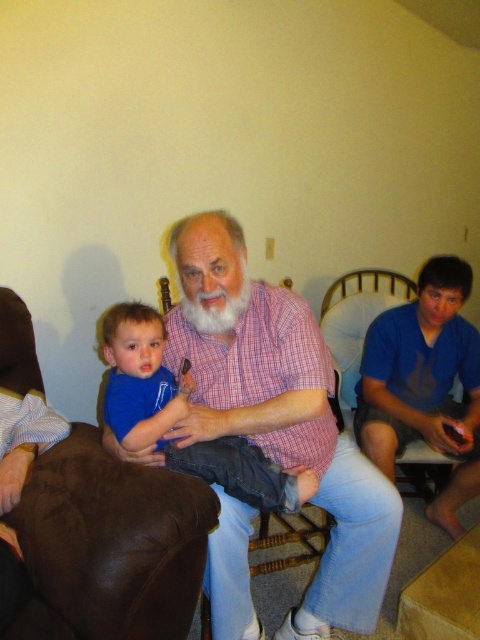
Which of these two, red plaid shirt at center or brown leather couch at lower left, stands shorter?

brown leather couch at lower left is shorter.

Can you confirm if red plaid shirt at center is taller than brown leather couch at lower left?

Indeed, red plaid shirt at center has a greater height compared to brown leather couch at lower left.

Who is more distant from viewer, [186,440] or [168,499]?

Point [186,440]

Identify the location of red plaid shirt at center. The height and width of the screenshot is (640, 480). (278, 412).

Who is taller, red plaid shirt at center or whitehairbeard at center?

red plaid shirt at center is taller.

Who is positioned more to the left, red plaid shirt at center or whitehairbeard at center?

From the viewer's perspective, whitehairbeard at center appears more on the left side.

Is point (295, 401) behind point (240, 282)?

Yes, point (295, 401) is farther from viewer.

Find the location of a particular element. The width and height of the screenshot is (480, 640). red plaid shirt at center is located at coordinates point(278,412).

From the picture: Does red plaid shirt at center appear over blue denim jeans at center?

Incorrect, red plaid shirt at center is not positioned above blue denim jeans at center.

Which is below, red plaid shirt at center or blue denim jeans at center?

red plaid shirt at center

Does point (223, 284) lie behind point (123, 442)?

Yes, it is behind point (123, 442).

Where is `red plaid shirt at center`? The width and height of the screenshot is (480, 640). red plaid shirt at center is located at coordinates (278, 412).